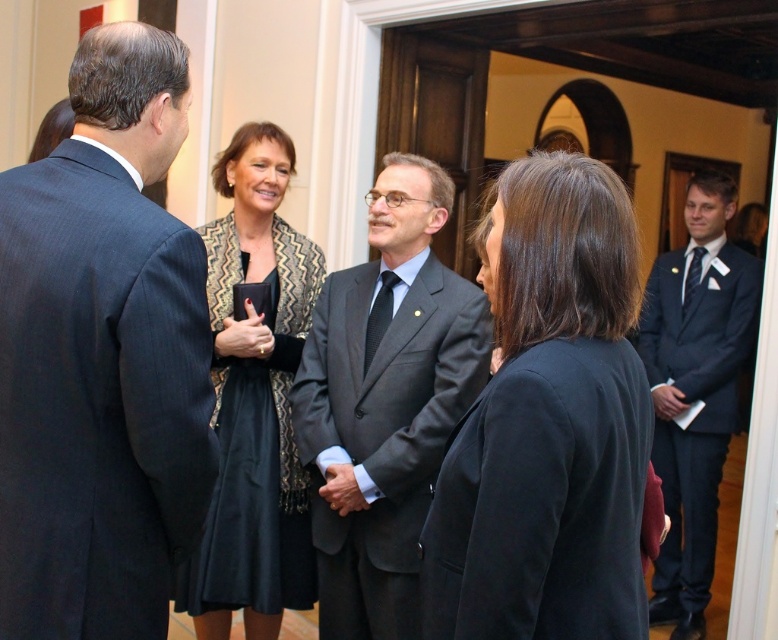
Question: Among these points, which one is nearest to the camera?

Choices:
 (A) (345, 291)
 (B) (696, 214)

Answer: (A)

Question: Can you confirm if dark blue suit at left is positioned below patterned fabric dress at center?

Choices:
 (A) no
 (B) yes

Answer: (A)

Question: Does dark blue suit at left appear over dark blue suit at right?

Choices:
 (A) no
 (B) yes

Answer: (B)

Question: Can you confirm if dark blue suit at left is positioned above dark gray suit at center?

Choices:
 (A) no
 (B) yes

Answer: (B)

Question: Estimate the real-world distances between objects in this image. Which object is closer to the patterned fabric dress at center?

Choices:
 (A) dark gray suit at center
 (B) dark blue suit at right
 (C) black matte blazer at center

Answer: (A)

Question: Which point is farther from the camera taking this photo?

Choices:
 (A) [x=121, y=177]
 (B) [x=251, y=557]
 (C) [x=395, y=339]
 (D) [x=689, y=504]

Answer: (D)